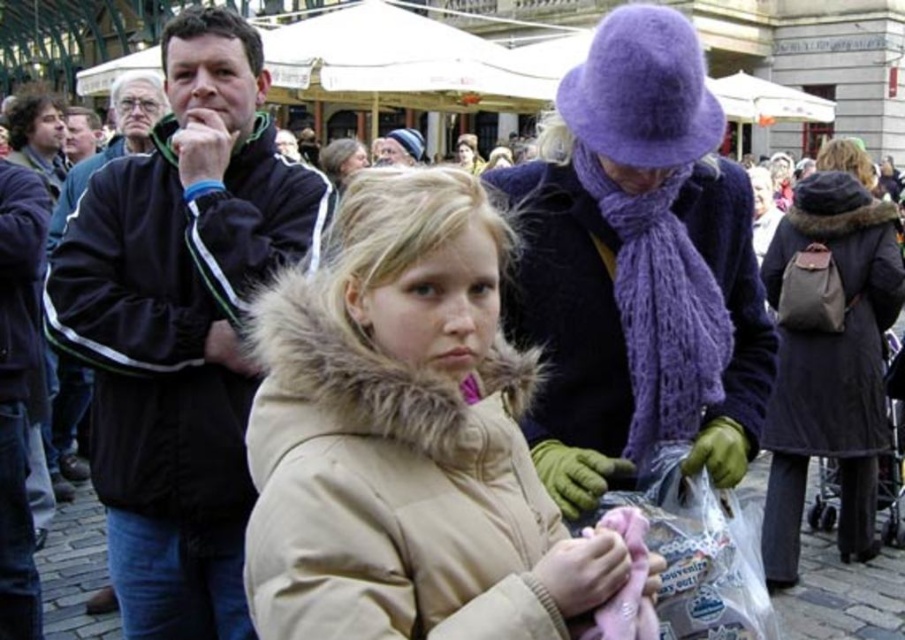
Question: Is black velour jacket at left above purple woolen hat at upper center?

Choices:
 (A) no
 (B) yes

Answer: (A)

Question: Which object is farther from the camera taking this photo?

Choices:
 (A) dark brown leather coat at center
 (B) purple woolen hat at upper center
 (C) black velour jacket at left

Answer: (A)

Question: Observing the image, what is the correct spatial positioning of purple woolen hat at upper center in reference to dark brown leather coat at center?

Choices:
 (A) above
 (B) below

Answer: (A)

Question: Based on their relative distances, which object is farther from the black velour jacket at left?

Choices:
 (A) dark brown leather coat at center
 (B) black fleece jacket at left
 (C) tan fur-lined coat at center

Answer: (A)

Question: Is tan fur-lined coat at center to the left of black velour jacket at left from the viewer's perspective?

Choices:
 (A) no
 (B) yes

Answer: (A)

Question: Based on their relative distances, which object is farther from the black fleece jacket at left?

Choices:
 (A) black velour jacket at left
 (B) purple woolen hat at upper center

Answer: (B)